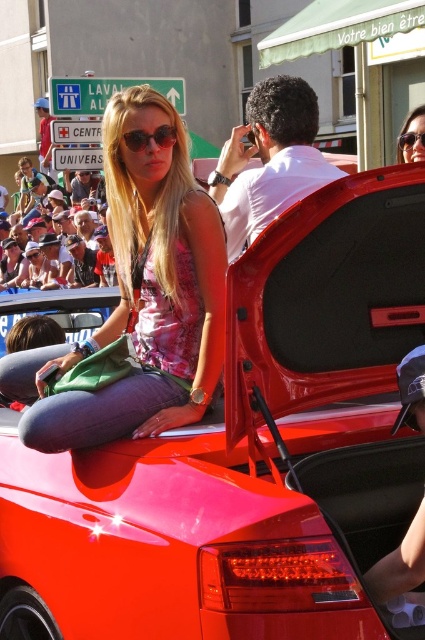
You are a photographer at the event and want to capture a closeup shot of the pink fabric dress at center without the matte black sunglasses at upper center appearing in the frame. Is this possible given their sizes?

The pink fabric dress at center is larger in size than the matte black sunglasses at upper center, so it is possible to frame the shot to focus on the dress while excluding the sunglasses.

You are a photographer standing in the crowd and want to take a photo of the pink fabric dress at center and the matte pink dress at center. Which dress should you focus on first to ensure it appears clearer in the photo?

You should focus on the pink fabric dress at center first because it is closer to the viewer, making it easier to capture clearly before adjusting focus for the matte pink dress at center.

You are a photographer trying to capture both the pink fabric dress at center and the matte pink dress at center in the same frame. Which dress should you focus on first if you want to ensure both are in focus, considering their sizes?

The pink fabric dress at center has a larger size compared to matte pink dress at center, so you should focus on the pink fabric dress at center first to ensure both are in focus.